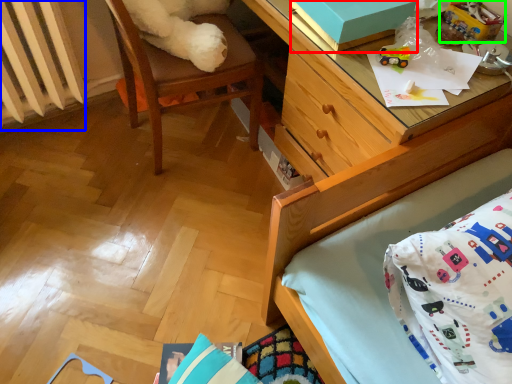
Question: Considering the real-world distances, which object is closest to box (highlighted by a red box)? radiator (highlighted by a blue box) or toy (highlighted by a green box).

Choices:
 (A) radiator
 (B) toy

Answer: (B)